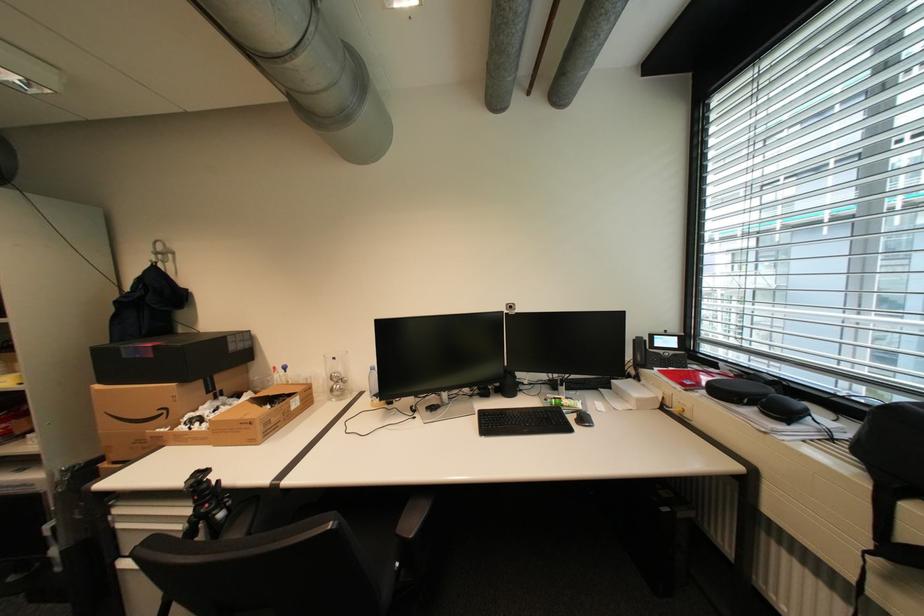
Find where to lift the open cardboard box. Please return your answer as a coordinate pair (x, y).

(245, 419)